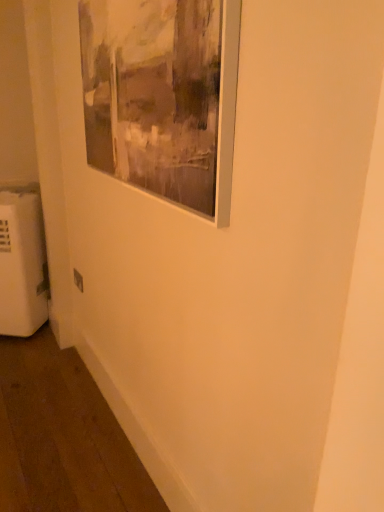
Question: Is white plastic electric outlet at lower left taller than matte silver picture frame at upper left?

Choices:
 (A) no
 (B) yes

Answer: (A)

Question: Does white plastic electric outlet at lower left have a larger size compared to matte silver picture frame at upper left?

Choices:
 (A) yes
 (B) no

Answer: (B)

Question: Can you confirm if white plastic electric outlet at lower left is positioned to the left of matte silver picture frame at upper left?

Choices:
 (A) yes
 (B) no

Answer: (A)

Question: Could you tell me if white plastic electric outlet at lower left is turned towards matte silver picture frame at upper left?

Choices:
 (A) yes
 (B) no

Answer: (B)

Question: Can you see white plastic electric outlet at lower left touching matte silver picture frame at upper left?

Choices:
 (A) yes
 (B) no

Answer: (B)

Question: Is white plastic electric outlet at lower left turned away from matte silver picture frame at upper left?

Choices:
 (A) yes
 (B) no

Answer: (B)

Question: Is matte silver picture frame at upper left at the right side of white plastic radiator at lower left?

Choices:
 (A) yes
 (B) no

Answer: (A)

Question: Does matte silver picture frame at upper left have a lesser height compared to white plastic radiator at lower left?

Choices:
 (A) no
 (B) yes

Answer: (B)

Question: Is white plastic radiator at lower left at the back of matte silver picture frame at upper left?

Choices:
 (A) no
 (B) yes

Answer: (A)

Question: Is matte silver picture frame at upper left wider than white plastic radiator at lower left?

Choices:
 (A) no
 (B) yes

Answer: (A)

Question: Is the depth of matte silver picture frame at upper left less than that of white plastic radiator at lower left?

Choices:
 (A) yes
 (B) no

Answer: (A)

Question: Is matte silver picture frame at upper left outside of white plastic radiator at lower left?

Choices:
 (A) no
 (B) yes

Answer: (B)

Question: Can you confirm if white plastic radiator at lower left is bigger than matte silver picture frame at upper left?

Choices:
 (A) yes
 (B) no

Answer: (A)